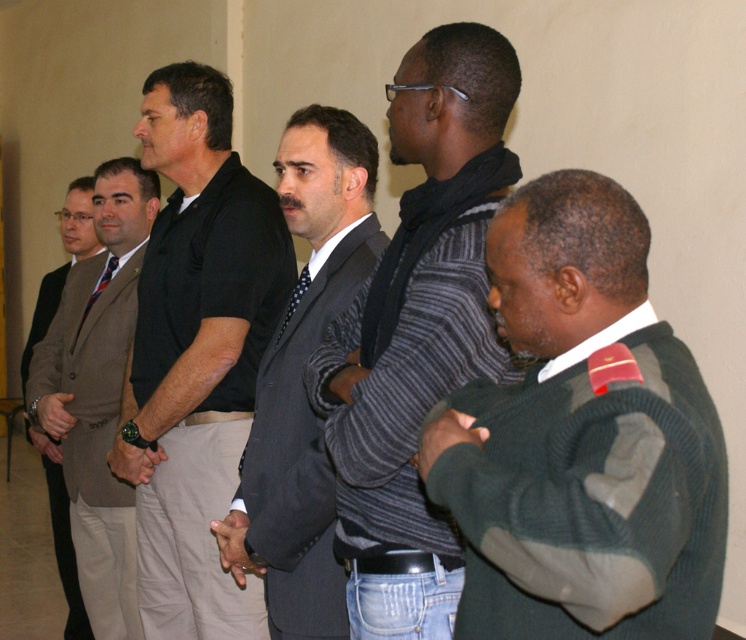
Question: Is striped sweater at center above dark gray suit at center?

Choices:
 (A) yes
 (B) no

Answer: (A)

Question: Which object is positioned closest to the striped fabric tie at center?

Choices:
 (A) brown woolen suit at left
 (B) striped sweater at center
 (C) dark gray suit at center
 (D) dark green sweater at center

Answer: (A)

Question: Can you confirm if striped sweater at center is positioned to the right of light brown suit at left?

Choices:
 (A) yes
 (B) no

Answer: (A)

Question: Among these points, which one is farthest from the camera?

Choices:
 (A) (372, 284)
 (B) (175, 438)

Answer: (B)

Question: Does striped sweater at center appear under striped fabric tie at center?

Choices:
 (A) no
 (B) yes

Answer: (B)

Question: Which is nearer to the striped fabric tie at center?

Choices:
 (A) black matte shirt at center
 (B) brown woolen suit at left

Answer: (B)